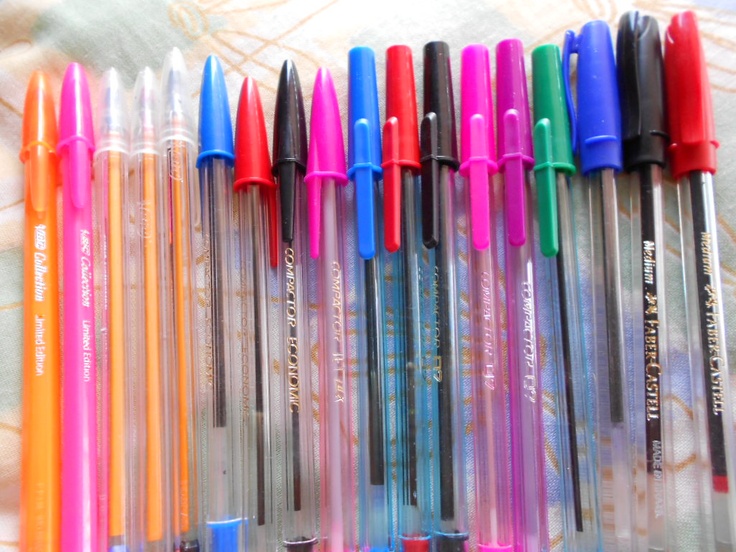
Locate an element on the screen. The height and width of the screenshot is (552, 736). the first seven pens from the left is located at coordinates (37, 364), (77, 363), (113, 354), (149, 346), (182, 342), (216, 335), (258, 339).